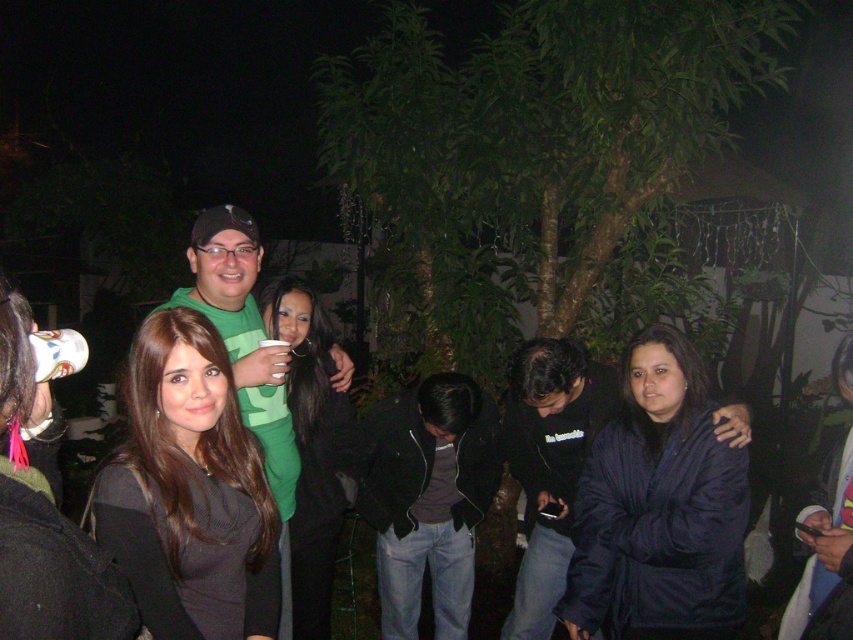
Question: Is black matte dress at center below green matte shirt at center?

Choices:
 (A) yes
 (B) no

Answer: (A)

Question: Does shiny black hair at center have a smaller size compared to green matte shirt at center?

Choices:
 (A) no
 (B) yes

Answer: (B)

Question: Which point appears farthest from the camera in this image?

Choices:
 (A) (146, 600)
 (B) (347, 474)
 (C) (276, 381)

Answer: (B)

Question: Is black matte dress at center smaller than dark blue jacket at lower right?

Choices:
 (A) yes
 (B) no

Answer: (A)

Question: Which object appears closest to the camera in this image?

Choices:
 (A) black matte dress at center
 (B) shiny black hair at center
 (C) dark blue jacket at lower right

Answer: (A)

Question: Among these objects, which one is farthest from the camera?

Choices:
 (A) dark blue jacket at lower right
 (B) shiny black hair at center
 (C) green matte shirt at center

Answer: (B)